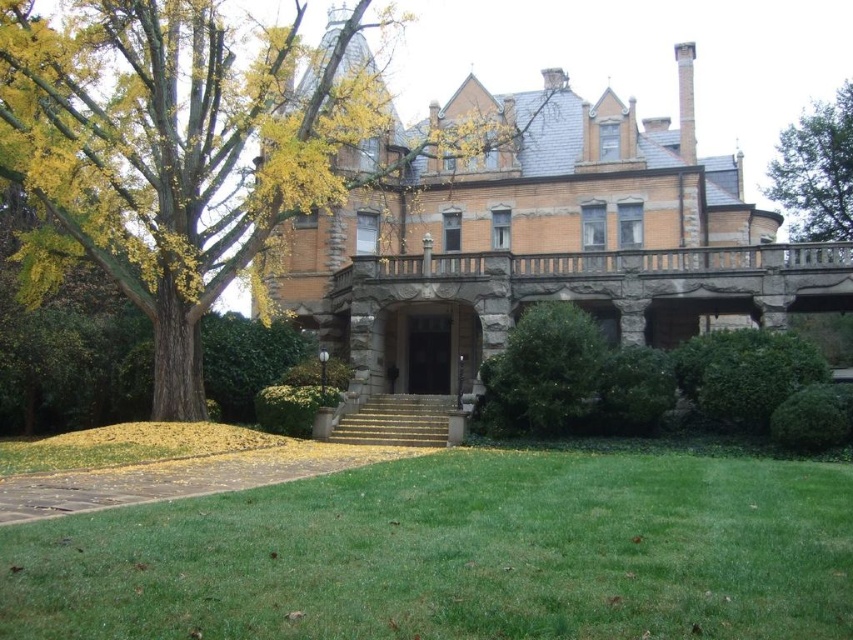
Which is in front, point (375, 552) or point (47, 228)?

Point (375, 552)

You are a GUI agent. You are given a task and a screenshot of the screen. Output one action in this format:
    pyautogui.click(x=<x>, y=<y>)
    Task: Click on the green grass at lower center
    This screenshot has height=640, width=853.
    Given the screenshot: What is the action you would take?
    pyautogui.click(x=456, y=554)

Describe the element at coordinates (456, 554) in the screenshot. The width and height of the screenshot is (853, 640). I see `green grass at lower center` at that location.

Who is positioned more to the right, green grass at lower center or brown stone mansion at center?

brown stone mansion at center is more to the right.

Does point (537, 609) come in front of point (492, 273)?

That is True.

Where is `green grass at lower center`? The image size is (853, 640). green grass at lower center is located at coordinates (456, 554).

Does green grass at lower center appear under green leafy tree at upper right?

Yes.

Can you confirm if green grass at lower center is wider than green leafy tree at upper right?

Yes.

Describe the element at coordinates (456, 554) in the screenshot. I see `green grass at lower center` at that location.

Where is `green grass at lower center`? This screenshot has width=853, height=640. green grass at lower center is located at coordinates (456, 554).